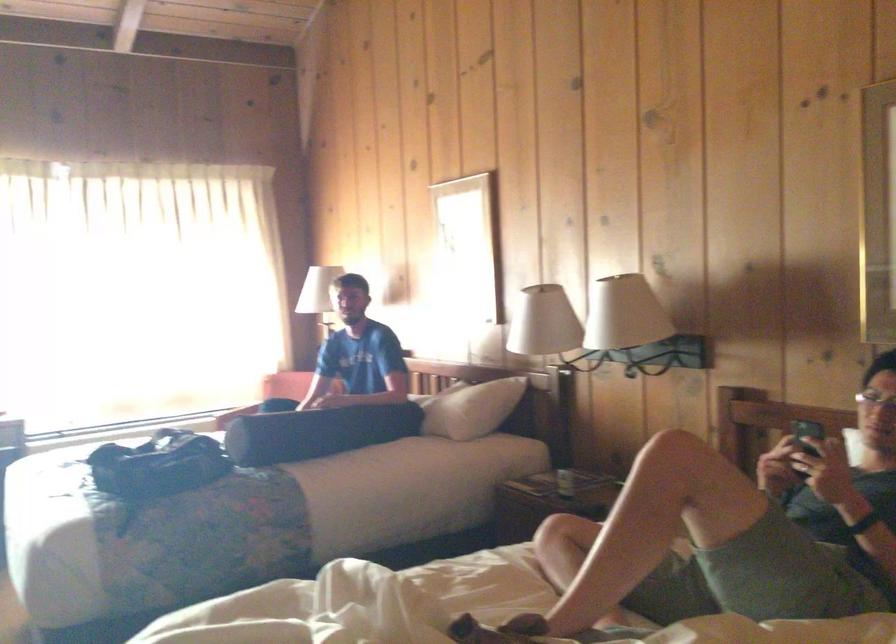
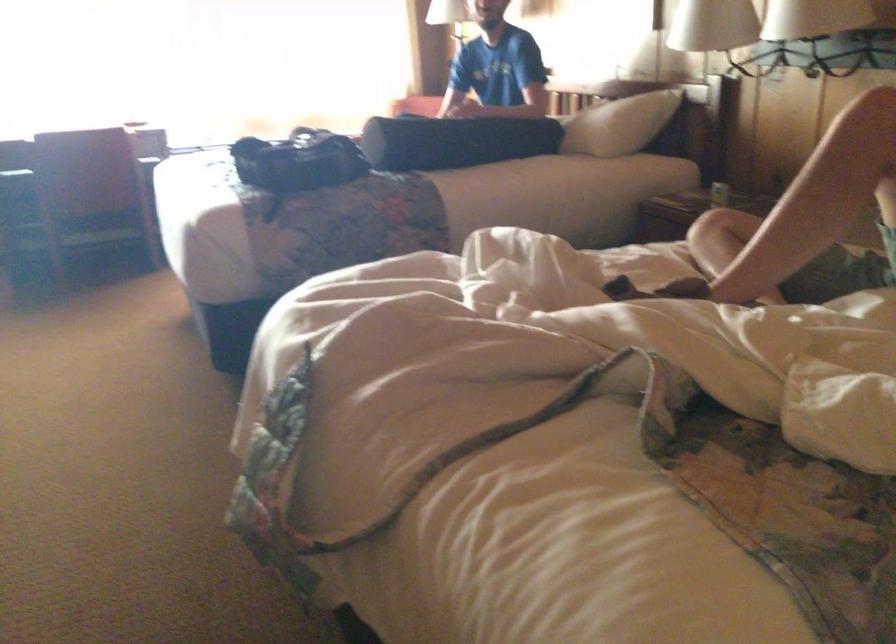
Locate, in the second image, the point that corresponds to point (567, 489) in the first image.

(719, 194)